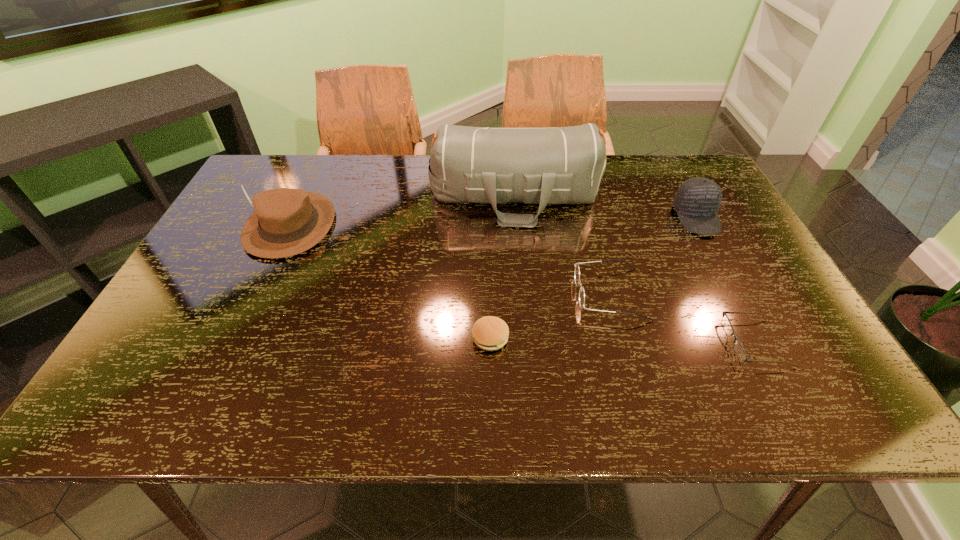
What are the coordinates of `object that is the third nearest to the leftmost object` in the screenshot? It's located at (577, 271).

Choose which object is the third nearest neighbor to the leftmost object. Please provide its 2D coordinates. Your answer should be formatted as a tuple, i.e. [(x, y)], where the tuple contains the x and y coordinates of a point satisfying the conditions above.

[(577, 271)]

The width and height of the screenshot is (960, 540). In order to click on free space that satisfies the following two spatial constraints: 1. on the back side of the duffel bag; 2. on the left side of the patty in this screenshot , I will do `click(488, 196)`.